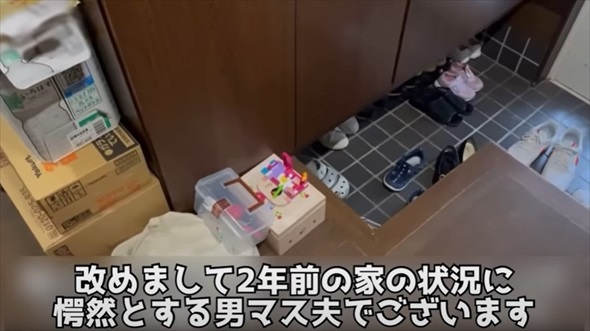
Locate an element on the screen. The height and width of the screenshot is (331, 590). kitchen cupboard is located at coordinates (253, 70), (339, 48), (452, 12).